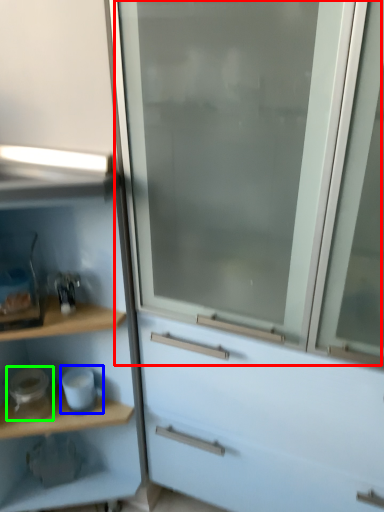
Question: Which object is the closest to the screen door (highlighted by a red box)? Choose among these: appliance (highlighted by a blue box) or appliance (highlighted by a green box).

Choices:
 (A) appliance
 (B) appliance

Answer: (A)